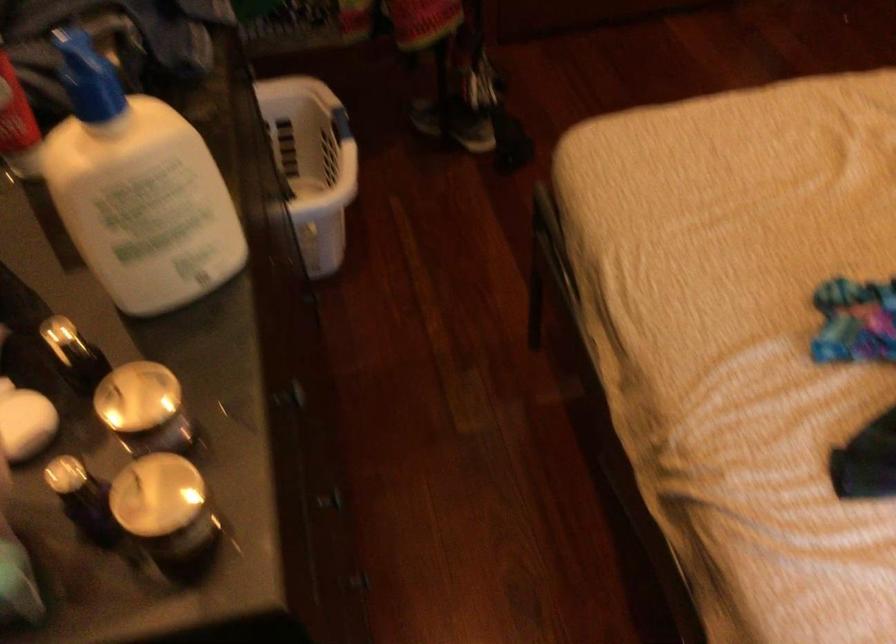
Where is `blue lotion pump`? The height and width of the screenshot is (644, 896). blue lotion pump is located at coordinates (88, 77).